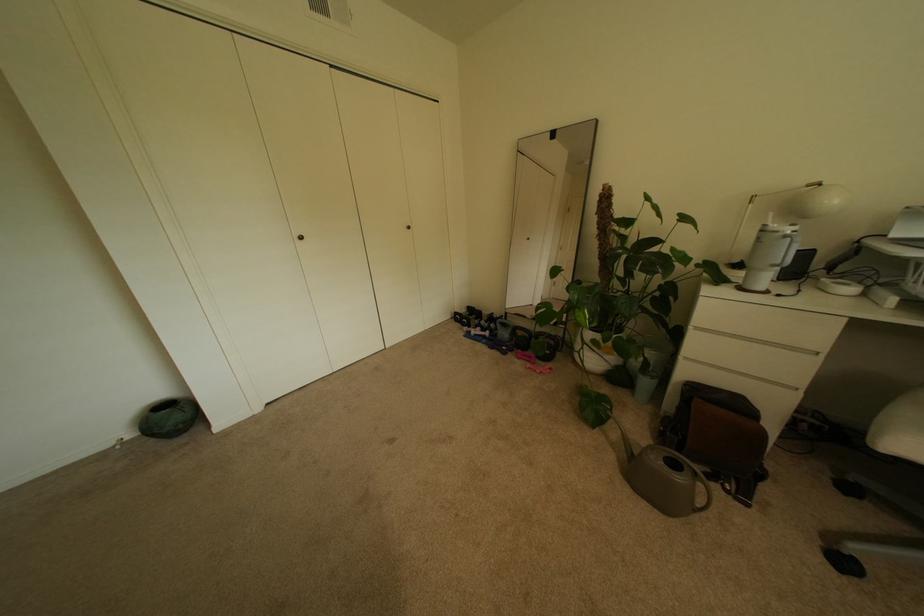
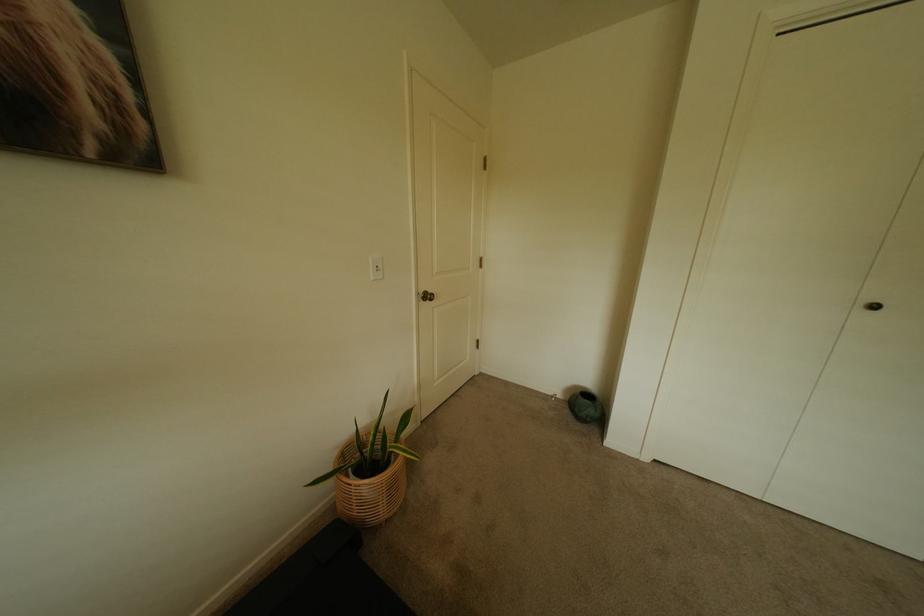
Question: How did the camera likely rotate?

Choices:
 (A) Left
 (B) Right
 (C) Up
 (D) Down

Answer: (A)